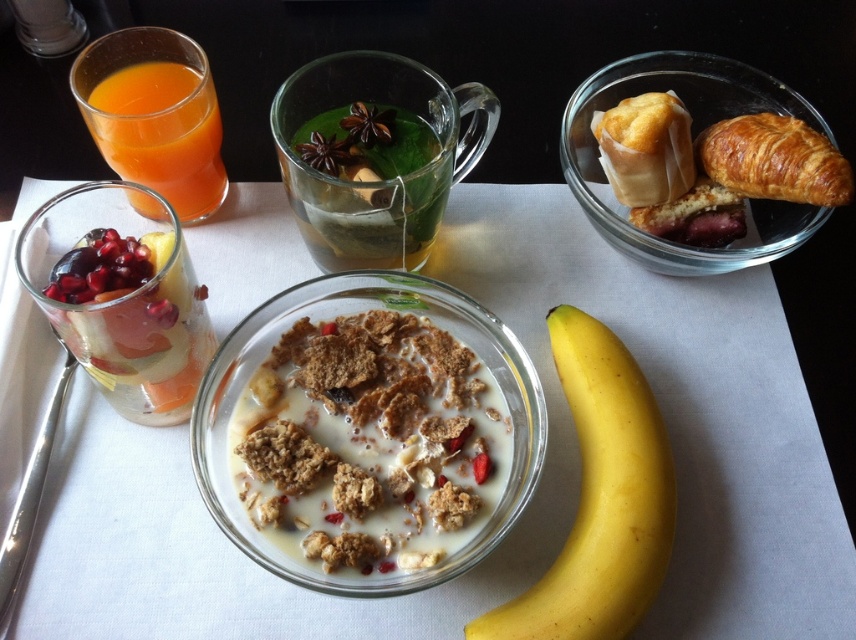
You are a food stylist arranging a photo shoot. You need to ensure that the brown crunchy cereal at center and the translucent glass at upper left are visible in the shot. Given their sizes, which object will appear larger in the final photograph?

The brown crunchy cereal at center will appear larger in the final photograph because it is much taller than the translucent glass at upper left.

You are holding a 12 inch ruler and want to measure the distance between the point at coordinates (596, 390) and yourself. Can you fit the ruler to measure this distance?

The distance between the point at coordinates (596, 390) and the viewer is 12.91 inches. Since the ruler is 12 inches long, it is slightly shorter than the required distance. Therefore, the ruler cannot fully measure the distance as it is 0.91 inches too short.

You are setting up a table for a breakfast buffet and need to ensure that all items fit within a 10 cm width constraint. Given the yellow smooth banana at center and the translucent glass at upper left, which item could potentially exceed the width limit based on their descriptions?

The yellow smooth banana at center might be wider than the translucent glass at upper left, so it could potentially exceed the 10 cm width limit.